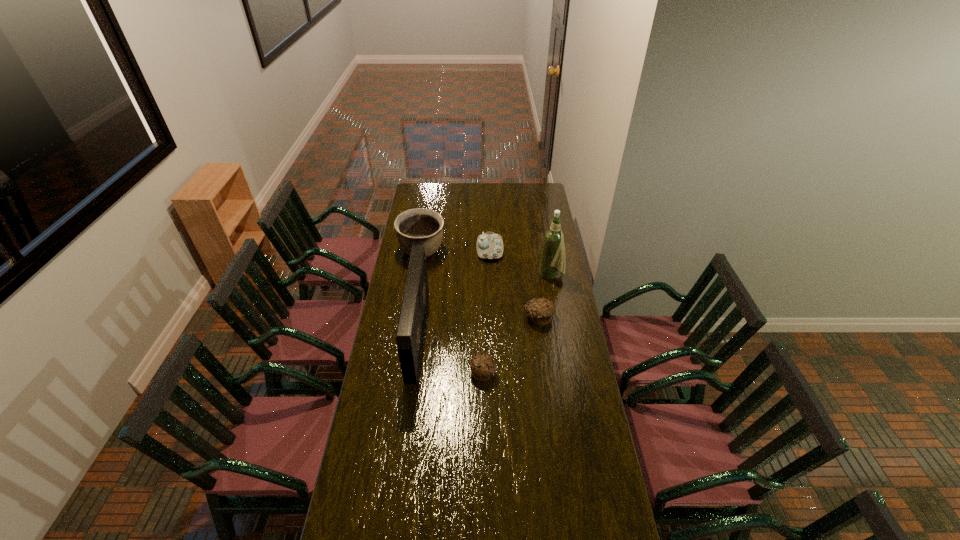
Locate an element on the screen. free space between the videotape and the chinaware is located at coordinates (454, 292).

This screenshot has width=960, height=540. Find the location of `free space between the shorter muffin and the taller muffin`. free space between the shorter muffin and the taller muffin is located at coordinates (511, 345).

At what (x,y) coordinates should I click in order to perform the action: click on vacant area between the pottery and the fourth nearest object. Please return your answer as a coordinate pair (x, y). Looking at the image, I should click on (487, 263).

Locate an element on the screen. This screenshot has height=540, width=960. free space between the wine bottle and the taller muffin is located at coordinates (545, 296).

The height and width of the screenshot is (540, 960). Identify the location of unoccupied area between the pottery and the wine bottle. (487, 263).

Locate which object is the third closest to the nearer muffin. Please provide its 2D coordinates. Your answer should be formatted as a tuple, i.e. [(x, y)], where the tuple contains the x and y coordinates of a point satisfying the conditions above.

[(553, 255)]

The height and width of the screenshot is (540, 960). I want to click on object that is the third closest to the wine bottle, so click(415, 227).

I want to click on vacant region that satisfies the following two spatial constraints: 1. on the front side of the nearer muffin; 2. on the right side of the second tallest object, so click(413, 373).